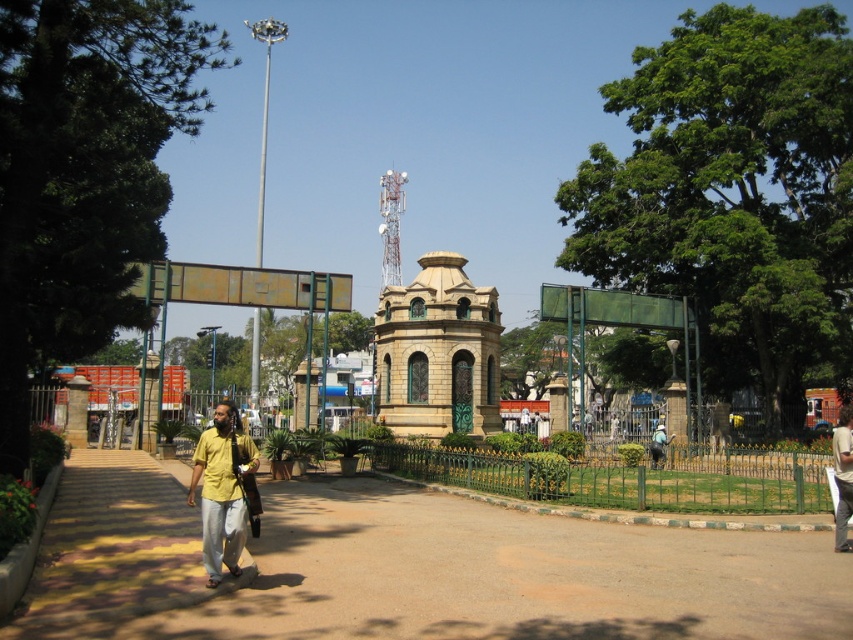
Question: Can you confirm if yellow cotton shirt at lower left is positioned below yellow shirt at center?

Choices:
 (A) yes
 (B) no

Answer: (B)

Question: Does yellow cotton shirt at lower left have a lesser width compared to yellow shirt at center?

Choices:
 (A) no
 (B) yes

Answer: (B)

Question: Does brown concrete pavement at center have a smaller size compared to yellow shirt at center?

Choices:
 (A) no
 (B) yes

Answer: (B)

Question: Estimate the real-world distances between objects in this image. Which object is closer to the yellow shirt at center?

Choices:
 (A) brown concrete pavement at center
 (B) yellow cotton shirt at lower left

Answer: (A)

Question: Which of the following is the closest to the observer?

Choices:
 (A) brown concrete pavement at center
 (B) yellow cotton shirt at lower left
 (C) yellow shirt at center

Answer: (A)

Question: Among these points, which one is nearest to the camera?

Choices:
 (A) (840, 476)
 (B) (213, 461)
 (C) (352, 516)

Answer: (B)